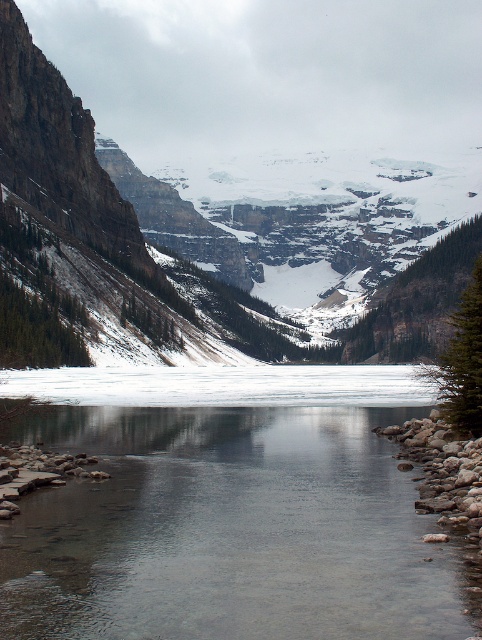
You are standing at the point marked as point (291, 144) in the image. What is the nearest object to you in the scene?

The nearest object to you at point (291, 144) is the rocky cliff at center.